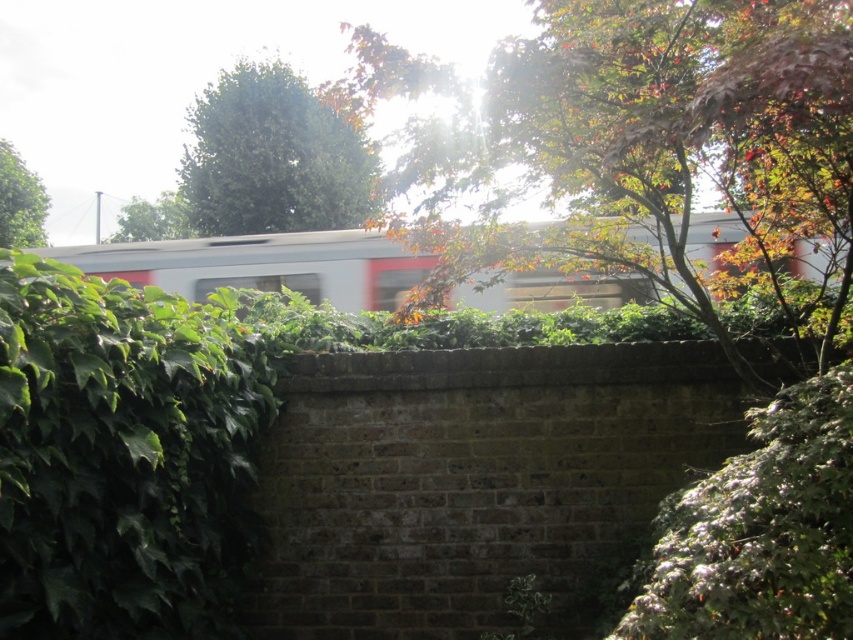
Question: Which object appears closest to the camera in this image?

Choices:
 (A) green leafy hedge at left
 (B) white glossy train at center

Answer: (A)

Question: Does green leafy hedge at center appear on the right side of white glossy train at center?

Choices:
 (A) yes
 (B) no

Answer: (A)

Question: Is white glossy train at center wider than green leafy tree at upper center?

Choices:
 (A) yes
 (B) no

Answer: (A)

Question: Is autumn leaves at upper center below white glossy train at center?

Choices:
 (A) no
 (B) yes

Answer: (A)

Question: Which point appears farthest from the camera in this image?

Choices:
 (A) (335, 248)
 (B) (247, 96)
 (C) (38, 502)
 (D) (24, 172)

Answer: (D)

Question: Which point is closer to the camera?

Choices:
 (A) white glossy train at center
 (B) green leafy hedge at center
 (C) green leafy hedge at left

Answer: (B)